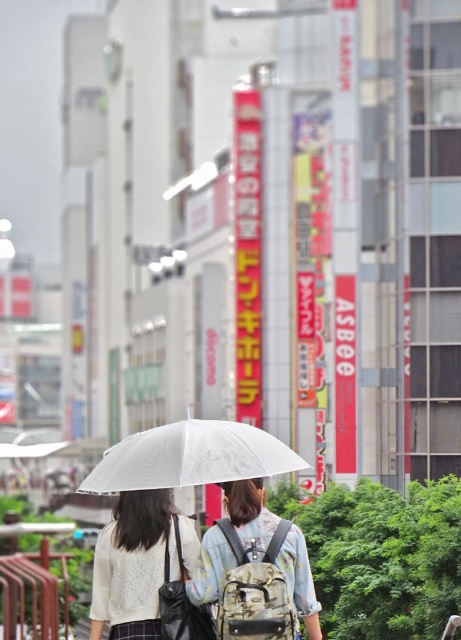
You are a photographer trying to capture both the white matte umbrella at lower left and the transparent nylon umbrella at center in a single shot. Given their sizes, which umbrella will appear larger in the photo?

The transparent nylon umbrella at center will appear larger in the photo because it is bigger in size than the white matte umbrella at lower left.

You are a delivery person who needs to place both the transparent plastic umbrella at center and the white matte umbrella at lower left into a storage box. The box can only hold items within a 15 feet length. Can you fit both umbrellas into the box without folding them?

The transparent plastic umbrella at center and the white matte umbrella at lower left are 17.49 feet apart from each other. Since the distance between them exceeds the box capacity of 15 feet, you cannot fit both umbrellas into the box without folding them.